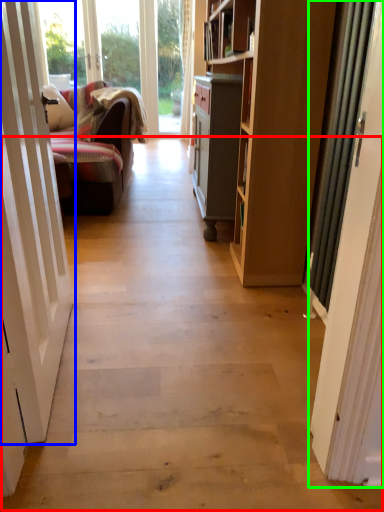
Question: Which object is the closest to the path (highlighted by a red box)? Choose among these: door (highlighted by a blue box) or door (highlighted by a green box).

Choices:
 (A) door
 (B) door

Answer: (A)